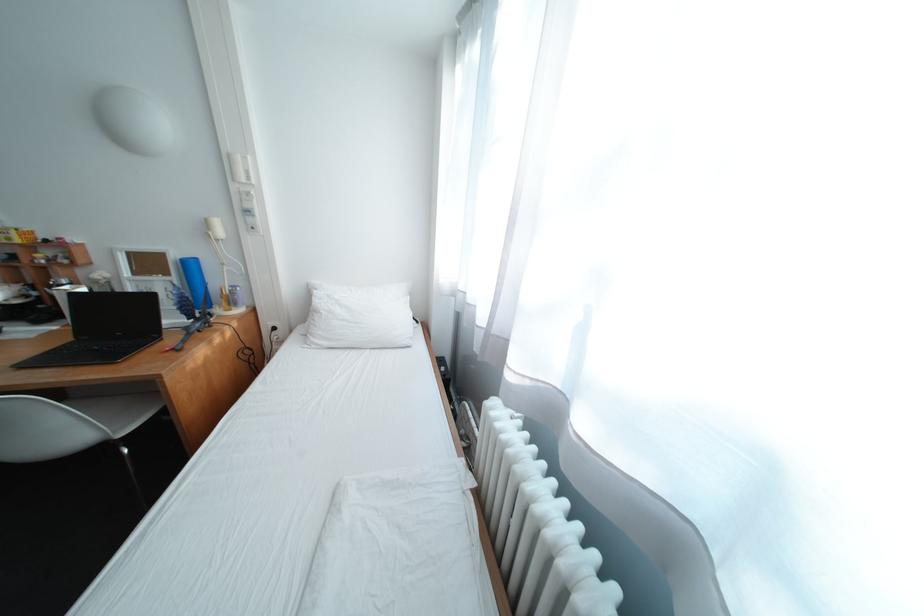
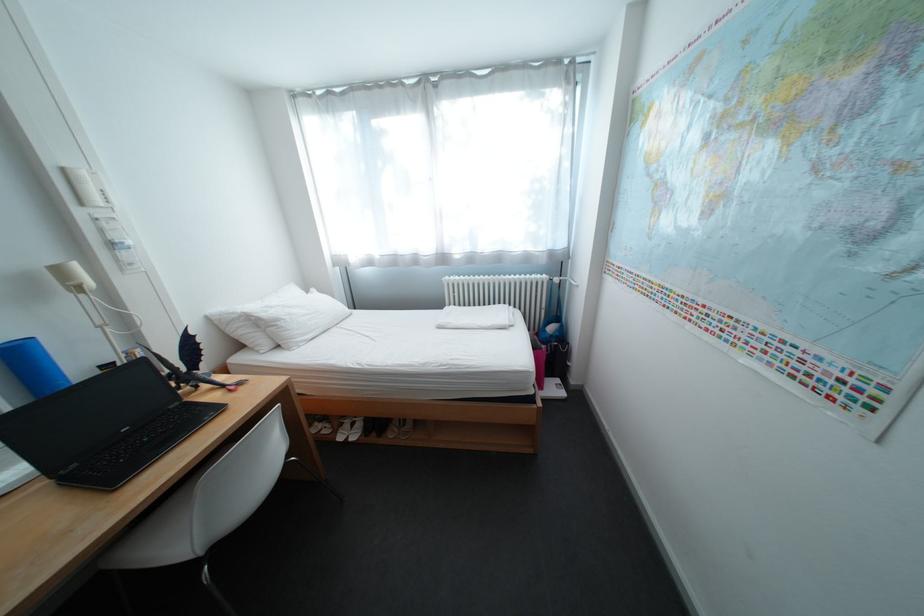
Find the pixel in the second image that matches the point at 330,314 in the first image.

(292, 322)